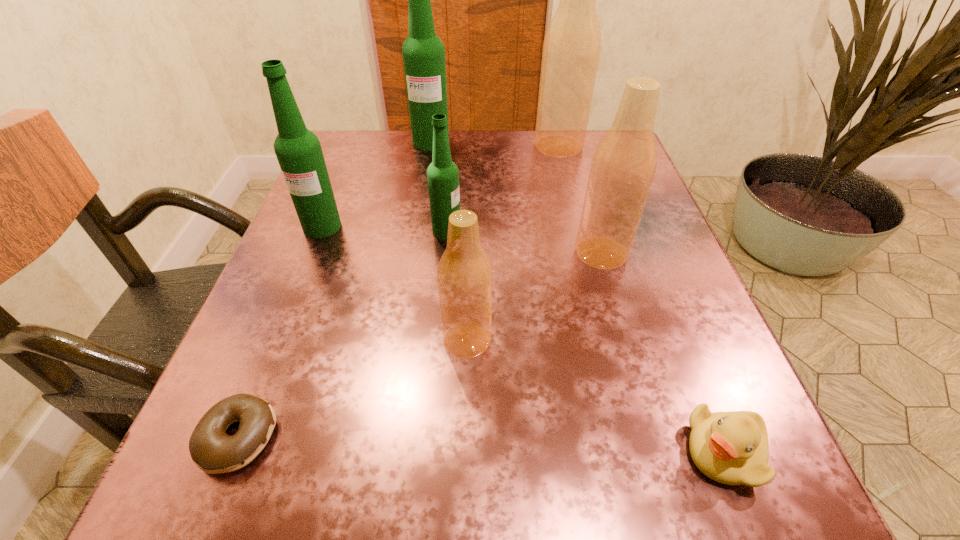
Locate an element on the screen. This screenshot has height=540, width=960. free spot that satisfies the following two spatial constraints: 1. on the label of the biggest green beer bottle; 2. on the right side of the third nearest object is located at coordinates (399, 340).

Locate an element on the screen. Image resolution: width=960 pixels, height=540 pixels. free space that satisfies the following two spatial constraints: 1. on the label of the second smallest green beer bottle; 2. on the right side of the sixth farthest object is located at coordinates (276, 340).